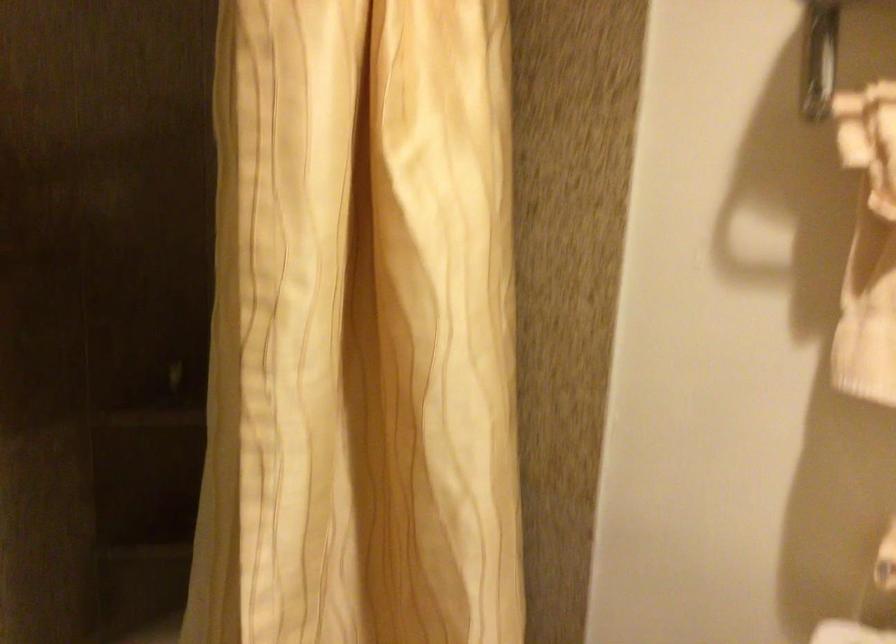
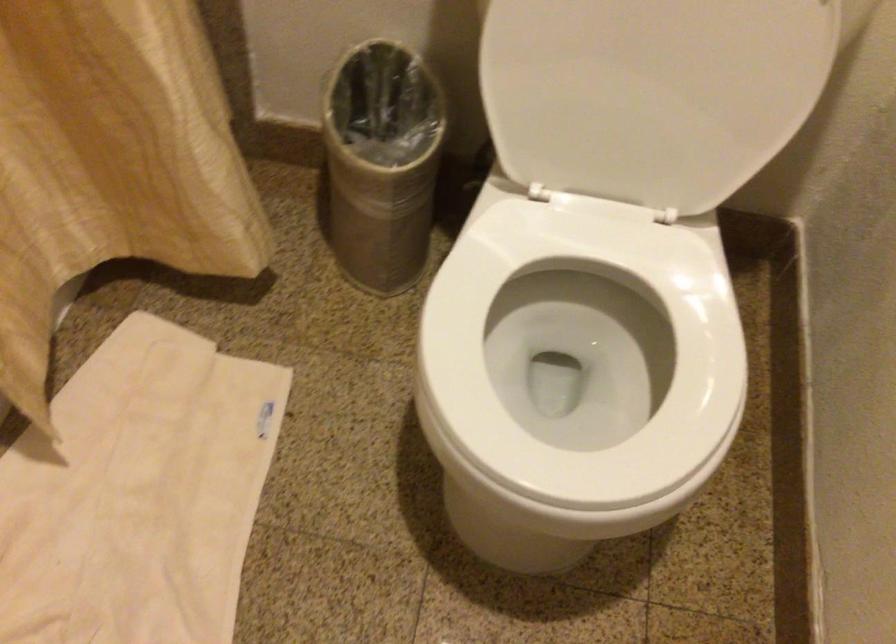
The first image is from the beginning of the video and the second image is from the end. How did the camera likely rotate when shooting the video?

The rotation direction of the camera is right-down.